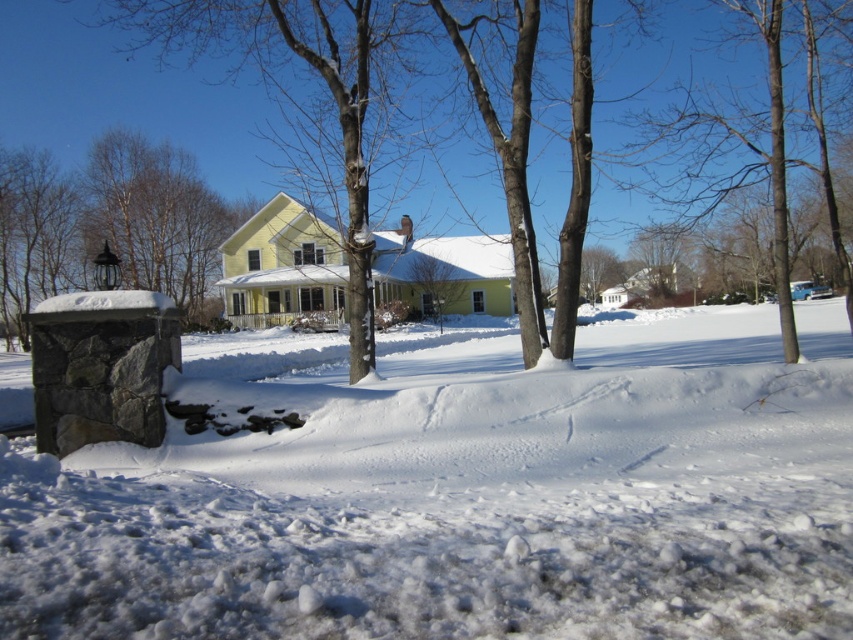
Measure the distance between white fluffy snow at lower center and camera.

white fluffy snow at lower center and camera are 2.79 meters apart.

Does white fluffy snow at lower center have a greater height compared to smooth gray stone post at left?

In fact, white fluffy snow at lower center may be shorter than smooth gray stone post at left.

This screenshot has width=853, height=640. Describe the element at coordinates (463, 496) in the screenshot. I see `white fluffy snow at lower center` at that location.

I want to click on white fluffy snow at lower center, so click(x=463, y=496).

Is brown smooth tree at center to the left of smooth gray stone post at left from the viewer's perspective?

No, brown smooth tree at center is not to the left of smooth gray stone post at left.

The height and width of the screenshot is (640, 853). I want to click on brown smooth tree at center, so click(753, 136).

Does point (766, 122) come farther from viewer compared to point (253, 205)?

That is False.

This screenshot has height=640, width=853. In order to click on brown smooth tree at center in this screenshot , I will do `click(753, 136)`.

Does white fluffy snow at lower center have a greater width compared to brown smooth tree at center?

Incorrect, white fluffy snow at lower center's width does not surpass brown smooth tree at center's.

Can you confirm if white fluffy snow at lower center is smaller than brown smooth tree at center?

Indeed, white fluffy snow at lower center has a smaller size compared to brown smooth tree at center.

Is point (799, 417) farther from viewer compared to point (688, 166)?

That is False.

Image resolution: width=853 pixels, height=640 pixels. I want to click on white fluffy snow at lower center, so click(x=463, y=496).